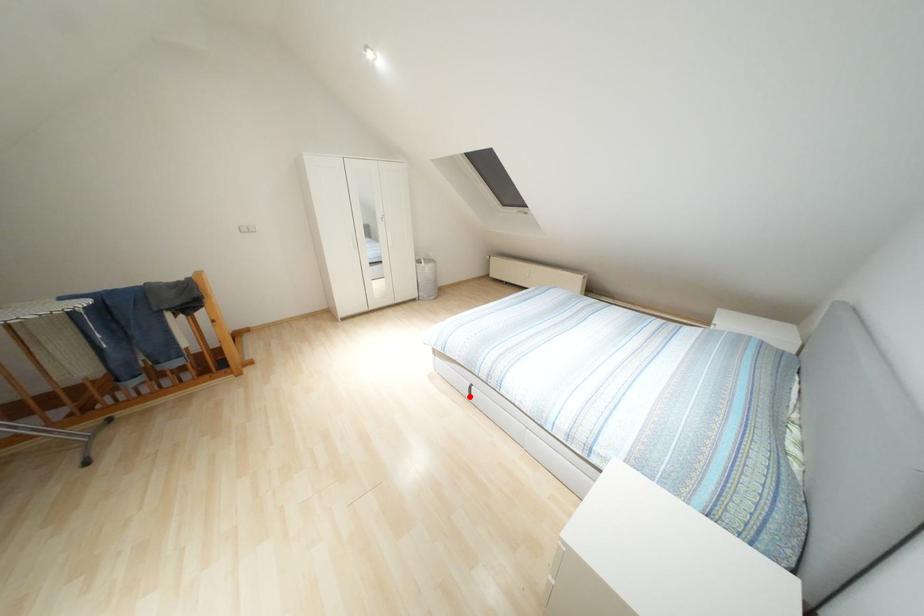
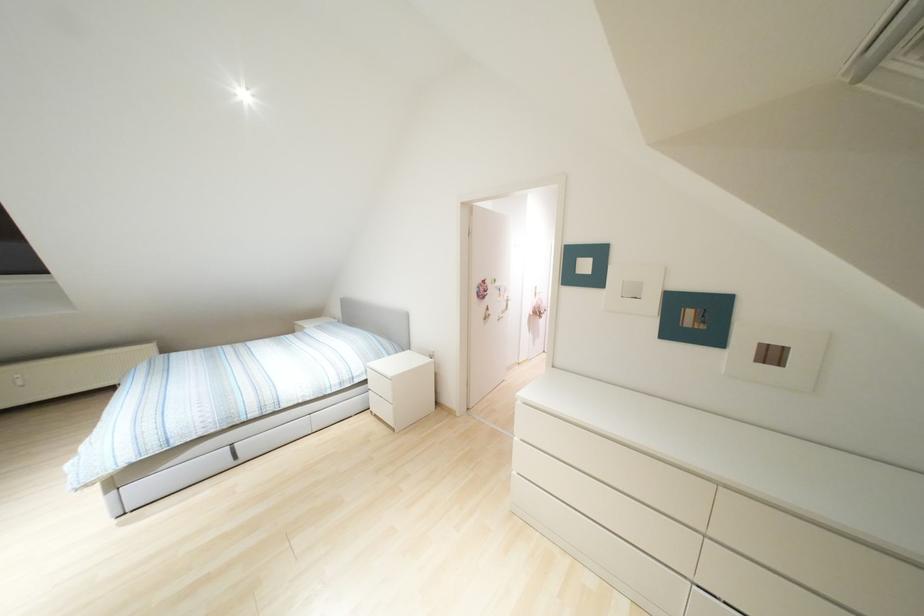
Question: I am providing you with two images of the same scene from different viewpoints. Given a red point in image1, look at the same physical point in image2. Is it:

Choices:
 (A) Closer to the viewpoint
 (B) Farther from the viewpoint

Answer: (A)